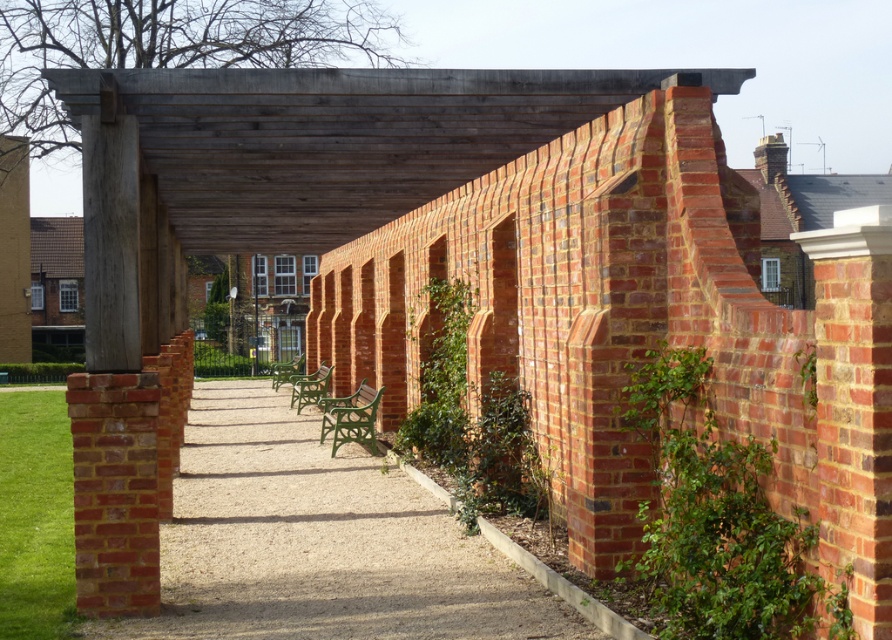
Question: Is red brick path at center closer to the viewer compared to red brick wall at left?

Choices:
 (A) no
 (B) yes

Answer: (B)

Question: Among these points, which one is farthest from the camera?

Choices:
 (A) (387, 624)
 (B) (96, 557)

Answer: (B)

Question: Can you confirm if red brick path at center is positioned to the right of red brick wall at left?

Choices:
 (A) no
 (B) yes

Answer: (A)

Question: Where is red brick path at center located in relation to red brick wall at left in the image?

Choices:
 (A) below
 (B) above

Answer: (A)

Question: Which point is closer to the camera?

Choices:
 (A) red brick wall at left
 (B) red brick path at center

Answer: (B)